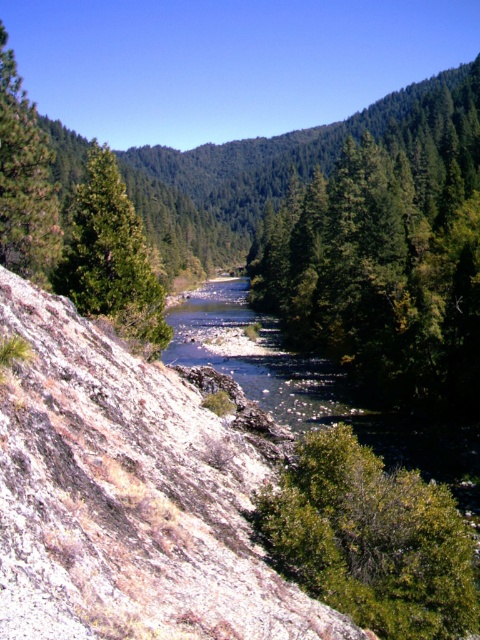
You are standing at the edge of the river in the valley and notice two points marked in the image. The first point is at coordinates point [4,289] and the second is at point [441,388]. Which of these two points is physically closer to your current position?

Point [4,289] is closer to the camera than point [441,388], so the first point is closer to your current position.

You are standing at the point marked as point [127,497] in the image. What is the terrain like at that location?

The terrain at point [127,497] is rocky.